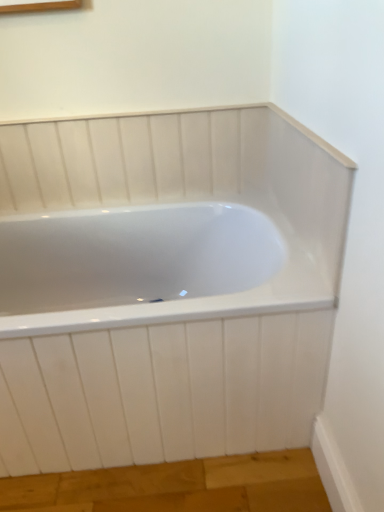
What do you see at coordinates (165, 286) in the screenshot? Image resolution: width=384 pixels, height=512 pixels. I see `white glossy bathtub at center` at bounding box center [165, 286].

Identify the location of white glossy bathtub at center. This screenshot has height=512, width=384. (165, 286).

The image size is (384, 512). Find the location of `white glossy bathtub at center`. white glossy bathtub at center is located at coordinates (165, 286).